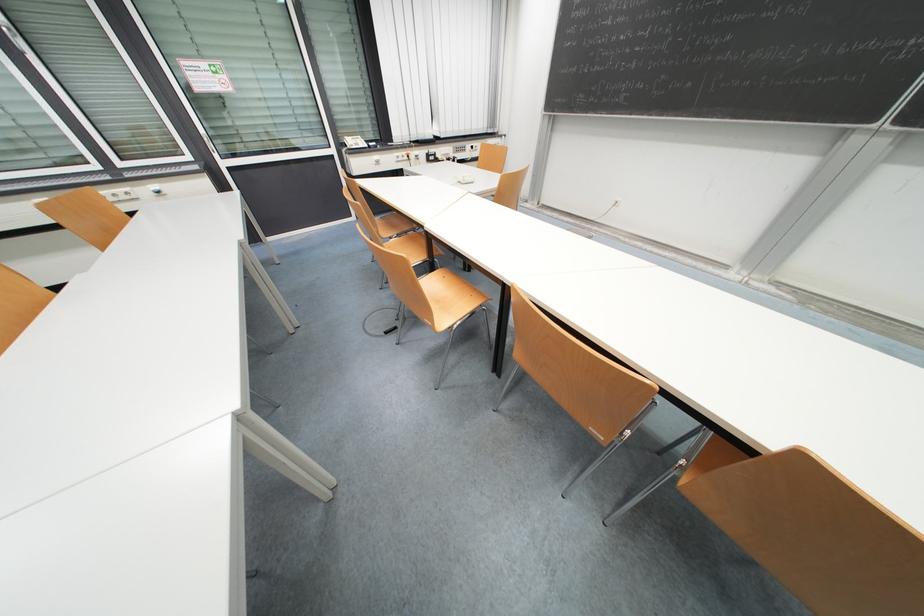
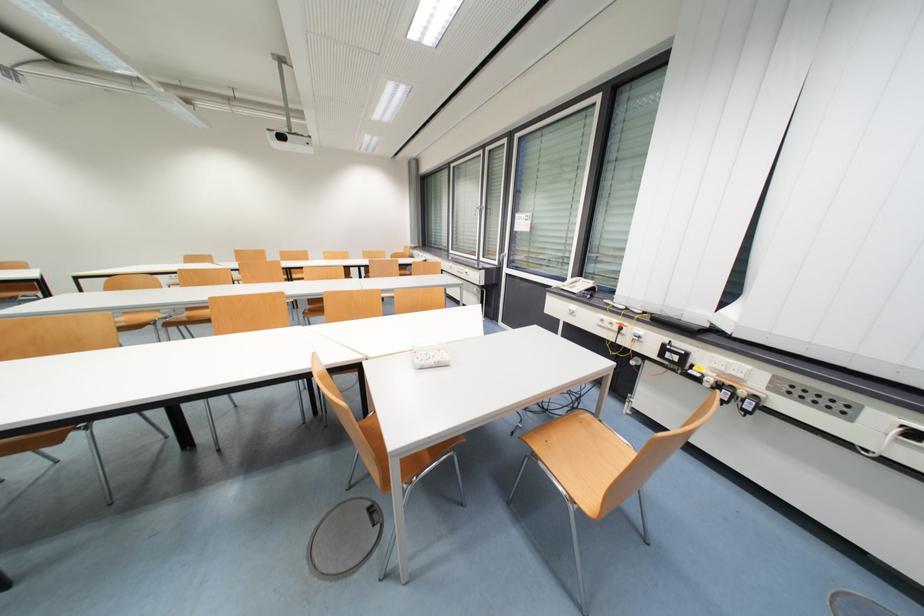
In the second image, find the point that corresponds to (433,158) in the first image.

(671, 350)